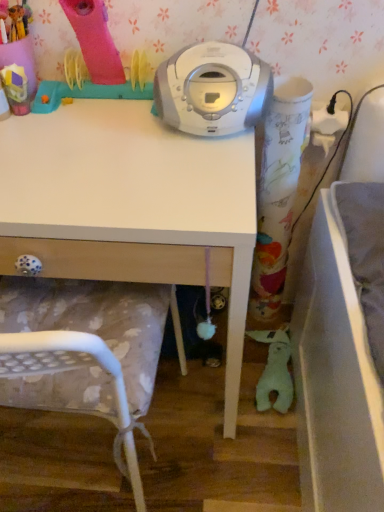
Where is `vacant area located to the right-hand side of rubberized pink hairdryer at upper left, the 2th toy in the bottom-to-top sequence`? The height and width of the screenshot is (512, 384). vacant area located to the right-hand side of rubberized pink hairdryer at upper left, the 2th toy in the bottom-to-top sequence is located at coordinates (69, 122).